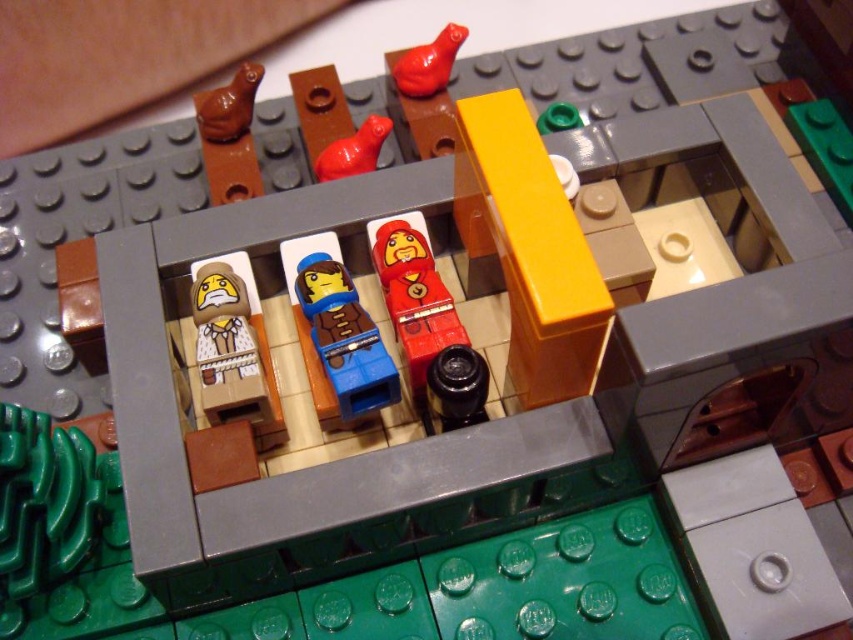
You are a LEGO designer trying to place a new accessory between the matte red bird at upper center and the rubber duck at center. Considering their widths, which object should you place closer to the narrower side?

The rubber duck at center is narrower than the matte red bird at upper center, so place the new accessory closer to the rubber duck at center to accommodate their widths.